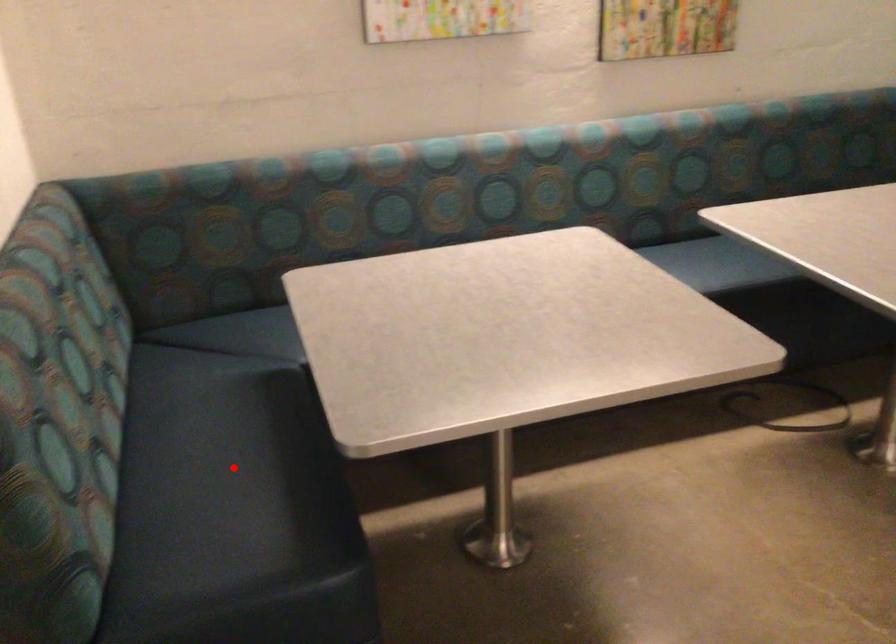
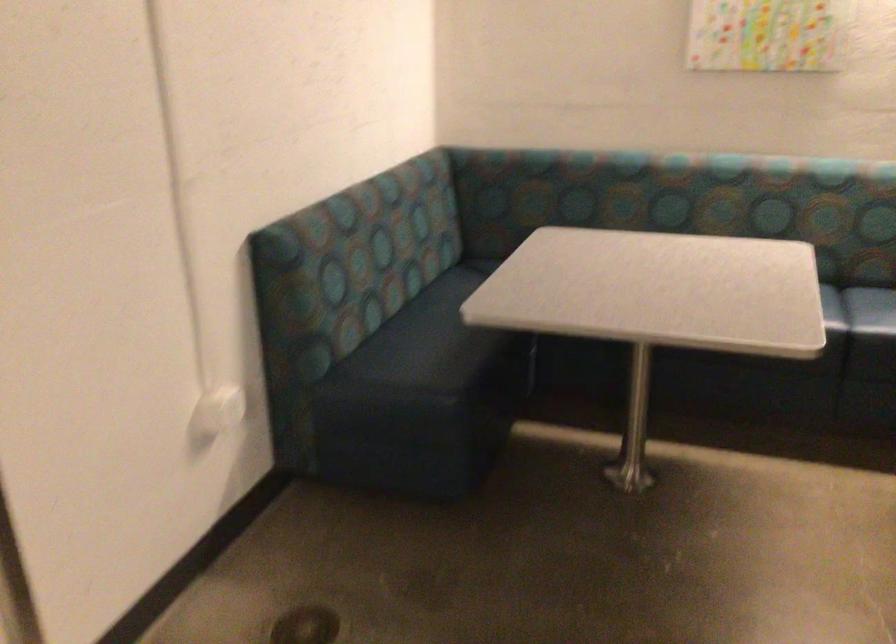
Question: I am providing you with two images of the same scene from different viewpoints. A red point is marked on the first image. At the location where the point appears in image 1, is it still visible in image 2?

Choices:
 (A) Yes
 (B) No

Answer: (A)